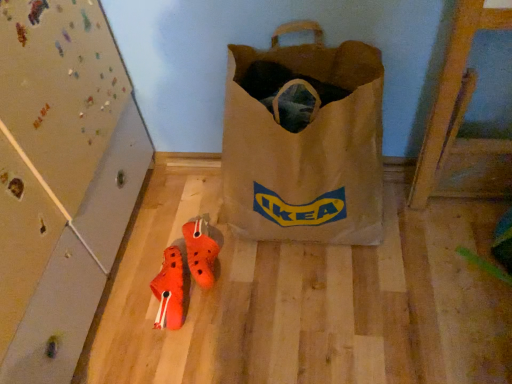
Find the location of a particular element. The image size is (512, 384). vacant area that lies between brown paper bag at center and orange rubber clogs at center, the 1th footwear viewed from the right is located at coordinates (257, 258).